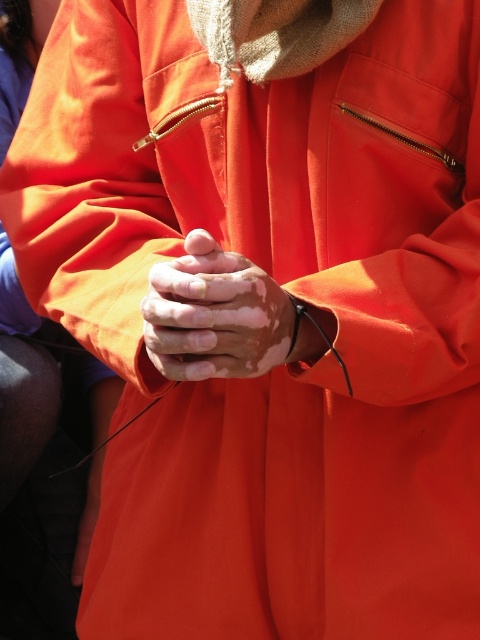
Question: Is smooth skin hands at center to the right of smooth orange hand at center from the viewer's perspective?

Choices:
 (A) yes
 (B) no

Answer: (A)

Question: Which point appears closest to the camera in this image?

Choices:
 (A) (83, 536)
 (B) (256, 312)

Answer: (B)

Question: Can you confirm if smooth skin hands at center is bigger than smooth orange hand at center?

Choices:
 (A) no
 (B) yes

Answer: (A)

Question: Can you confirm if smooth skin hands at center is positioned to the left of smooth orange hand at center?

Choices:
 (A) no
 (B) yes

Answer: (A)